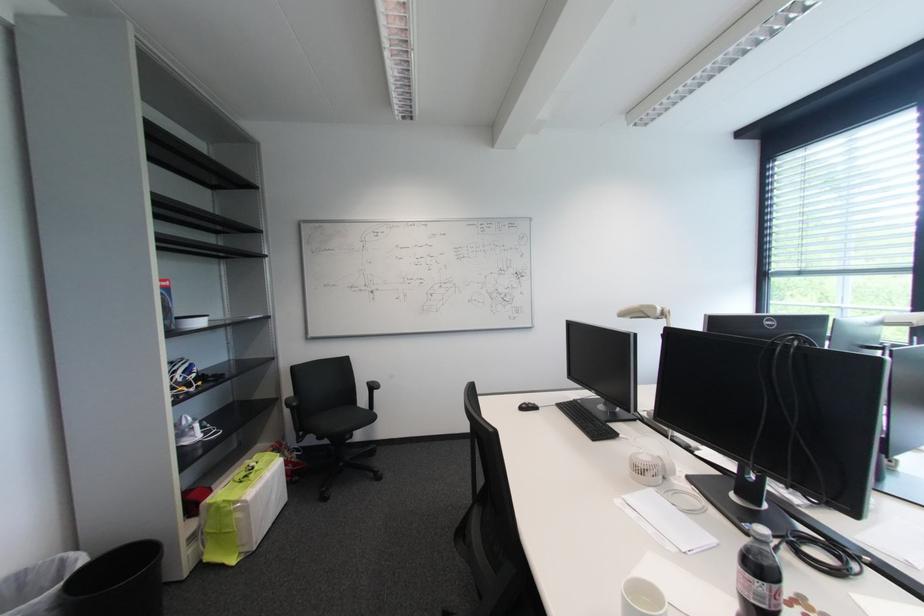
Where would you resting arm the black chair armrest? Please return your answer as a coordinate pair (x, y).

(371, 392)